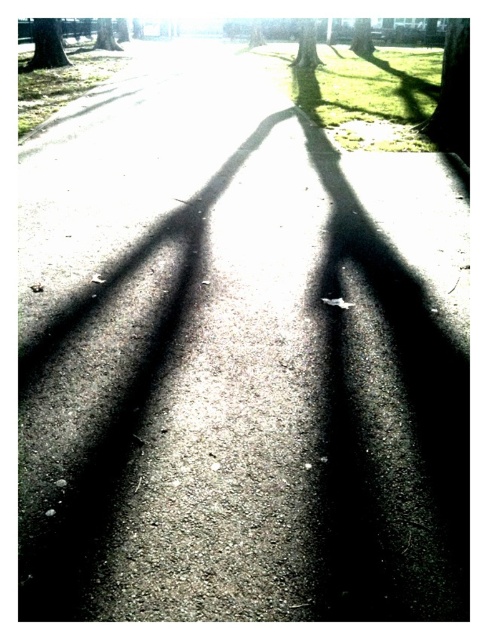
Question: Is green rough bark tree at upper right smaller than green textured tree at upper center?

Choices:
 (A) yes
 (B) no

Answer: (A)

Question: Estimate the real-world distances between objects in this image. Which object is closer to the green rough bark tree at upper right?

Choices:
 (A) smooth bark tree at upper center
 (B) green textured tree at upper center

Answer: (B)

Question: Is green leafy tree at upper center closer to camera compared to smooth bark tree at upper center?

Choices:
 (A) no
 (B) yes

Answer: (B)

Question: In this image, where is green textured tree trunk at upper left located relative to green leafy tree at upper center?

Choices:
 (A) above
 (B) below

Answer: (B)

Question: Estimate the real-world distances between objects in this image. Which object is closer to the green textured tree trunk at upper left?

Choices:
 (A) green leafy tree at upper center
 (B) green rough bark tree at upper right

Answer: (B)

Question: Which object is the farthest from the smooth bark tree at upper center?

Choices:
 (A) green textured tree at upper center
 (B) green rough bark tree at upper right
 (C) green textured tree trunk at upper left

Answer: (B)